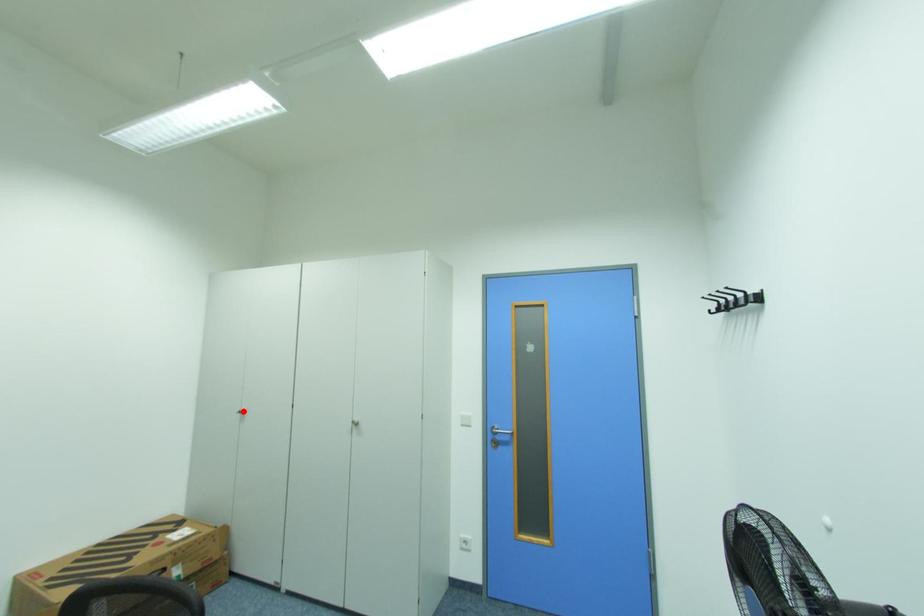
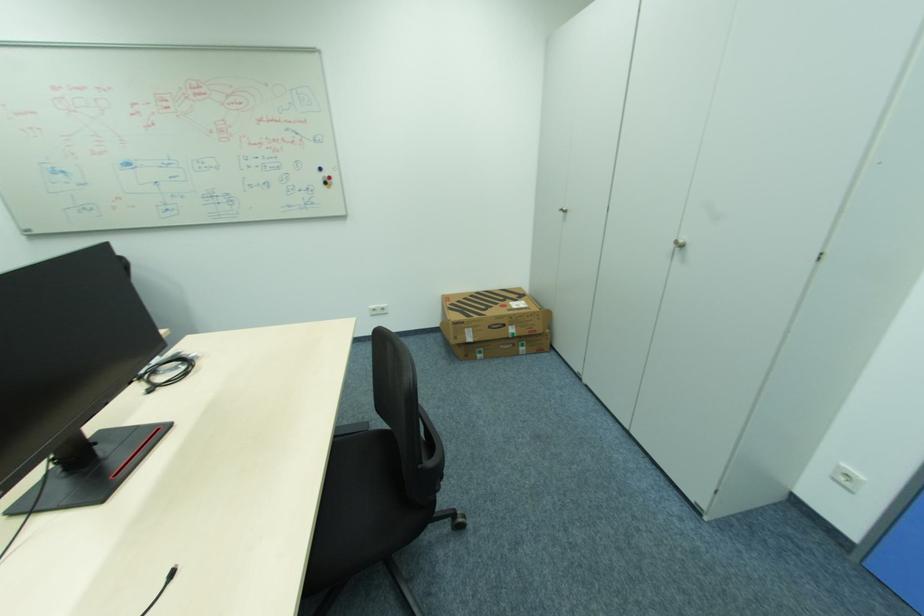
Where in the second image is the point corresponding to the highlighted location from the first image?

(565, 209)